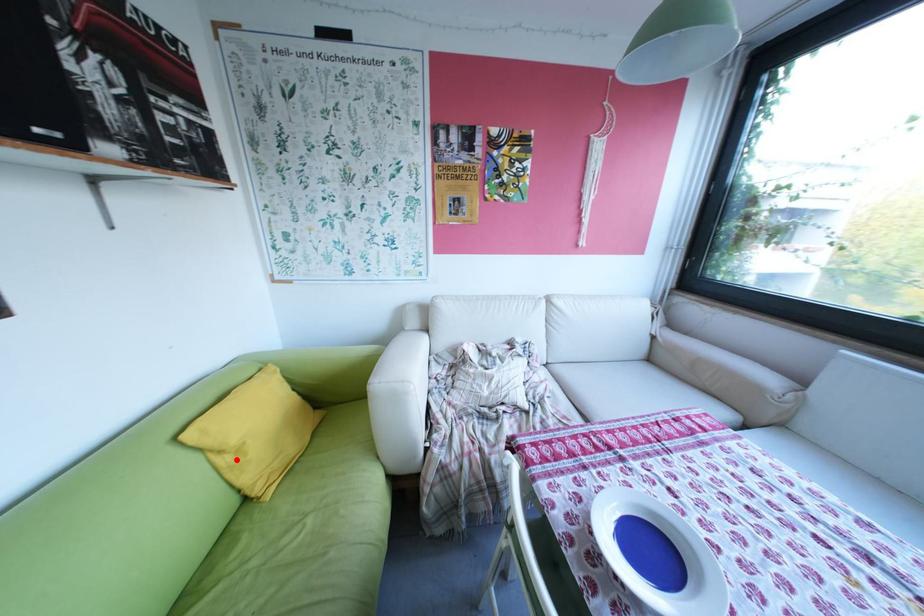
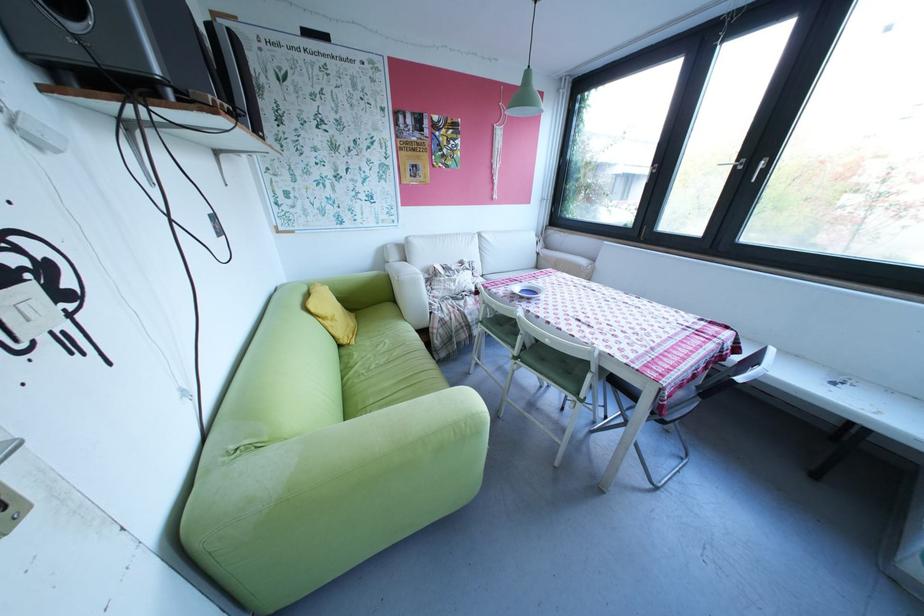
Where in the second image is the point corresponding to the highlighted location from the first image?

(339, 323)